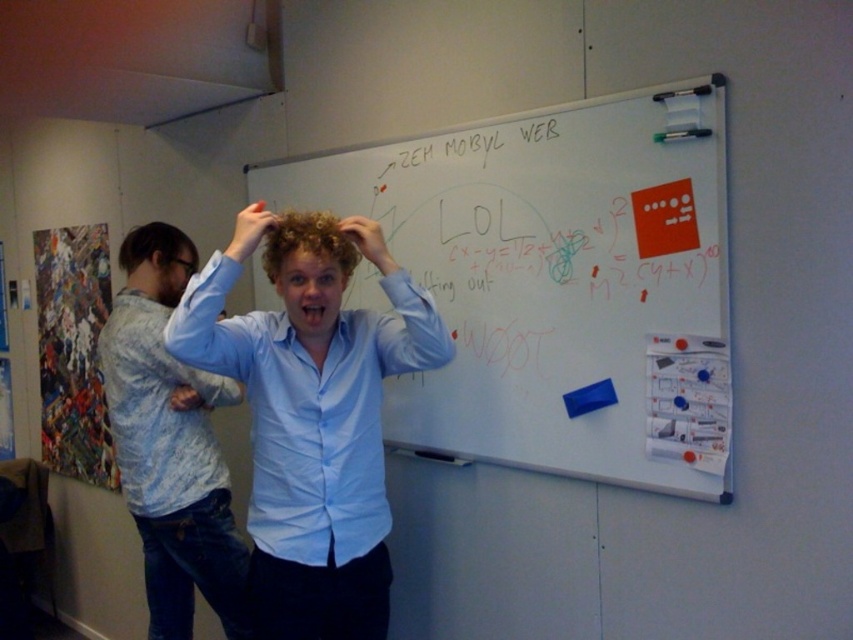
You are a photographer standing at the front of the room. You want to take a photo of both the point at (161, 529) and the point at (256, 228). Which point will appear closer to the bottom of the photo?

The point at (256, 228) will appear closer to the bottom of the photo because it is closer to the camera than the other point.

You are an AI assistant analyzing the image. The blue cotton shirt at center and matte skin at center are both visible in the scene. Which object takes up more space in the image?

The blue cotton shirt at center is larger in size than matte skin at center, so it takes up more space in the image.